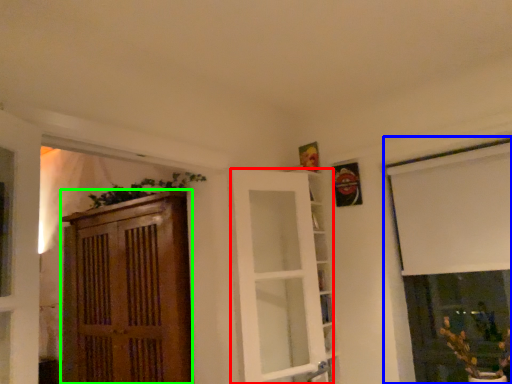
Question: Which object is positioned closest to door (highlighted by a red box)? Select from window (highlighted by a blue box) and cabinetry (highlighted by a green box).

Choices:
 (A) window
 (B) cabinetry

Answer: (B)